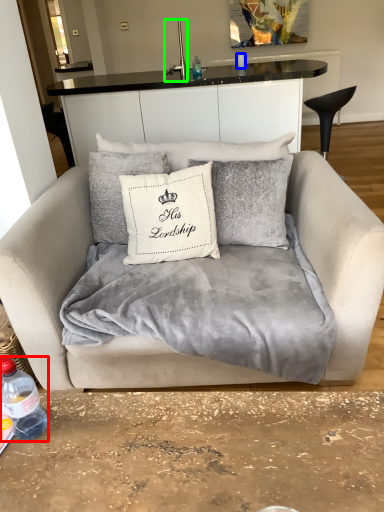
Question: Which is farther away from bottle (highlighted by a red box)? coffee cup (highlighted by a blue box) or faucet (highlighted by a green box)?

Choices:
 (A) coffee cup
 (B) faucet

Answer: (A)